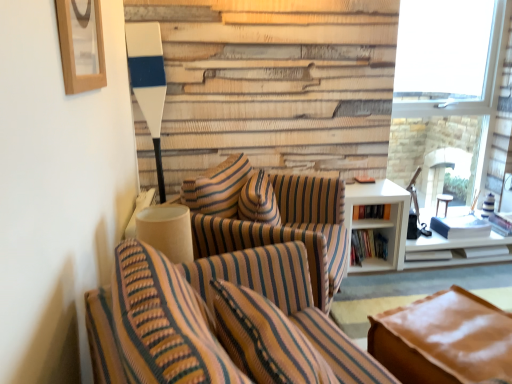
Question: From a real-world perspective, is brown leather couch at lower right physically above wooden picture frame at upper left?

Choices:
 (A) yes
 (B) no

Answer: (B)

Question: Is brown leather couch at lower right facing towards wooden picture frame at upper left?

Choices:
 (A) no
 (B) yes

Answer: (A)

Question: Considering the relative sizes of brown leather couch at lower right and wooden picture frame at upper left in the image provided, is brown leather couch at lower right wider than wooden picture frame at upper left?

Choices:
 (A) yes
 (B) no

Answer: (A)

Question: From the image's perspective, would you say brown leather couch at lower right is positioned over wooden picture frame at upper left?

Choices:
 (A) no
 (B) yes

Answer: (A)

Question: Can you confirm if brown leather couch at lower right is taller than wooden picture frame at upper left?

Choices:
 (A) yes
 (B) no

Answer: (A)

Question: Could wooden picture frame at upper left be considered to be inside brown leather couch at lower right?

Choices:
 (A) yes
 (B) no

Answer: (B)

Question: Does hardcover books at right, which is the second book from bottom to top, have a smaller size compared to wooden picture frame at upper left?

Choices:
 (A) yes
 (B) no

Answer: (A)

Question: Is hardcover books at right, which is the second book from bottom to top, in contact with wooden picture frame at upper left?

Choices:
 (A) yes
 (B) no

Answer: (B)

Question: From the image's perspective, does hardcover books at right, the first book in the top-to-bottom sequence, appear higher than wooden picture frame at upper left?

Choices:
 (A) no
 (B) yes

Answer: (A)

Question: Is hardcover books at right, which is the second book from bottom to top, not within wooden picture frame at upper left?

Choices:
 (A) no
 (B) yes

Answer: (B)

Question: Considering the relative sizes of hardcover books at right, the first book in the top-to-bottom sequence, and wooden picture frame at upper left in the image provided, is hardcover books at right, the first book in the top-to-bottom sequence, thinner than wooden picture frame at upper left?

Choices:
 (A) yes
 (B) no

Answer: (B)

Question: Is wooden picture frame at upper left inside hardcover books at right, which is the second book from bottom to top?

Choices:
 (A) yes
 (B) no

Answer: (B)

Question: Is hardcover books at right, the first book in the top-to-bottom sequence, looking in the opposite direction of striped fabric chair at center, marked as the 2th chair in a front-to-back arrangement?

Choices:
 (A) no
 (B) yes

Answer: (A)